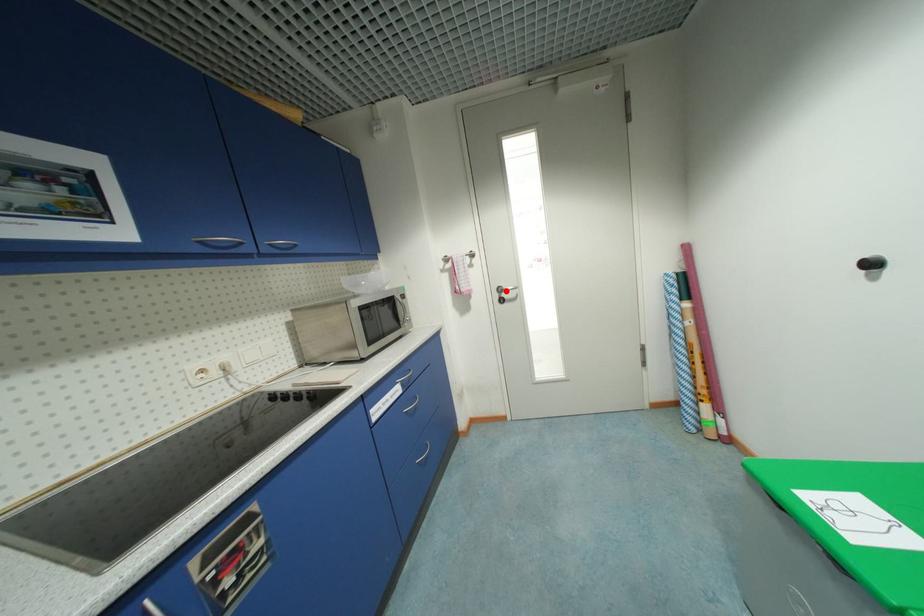
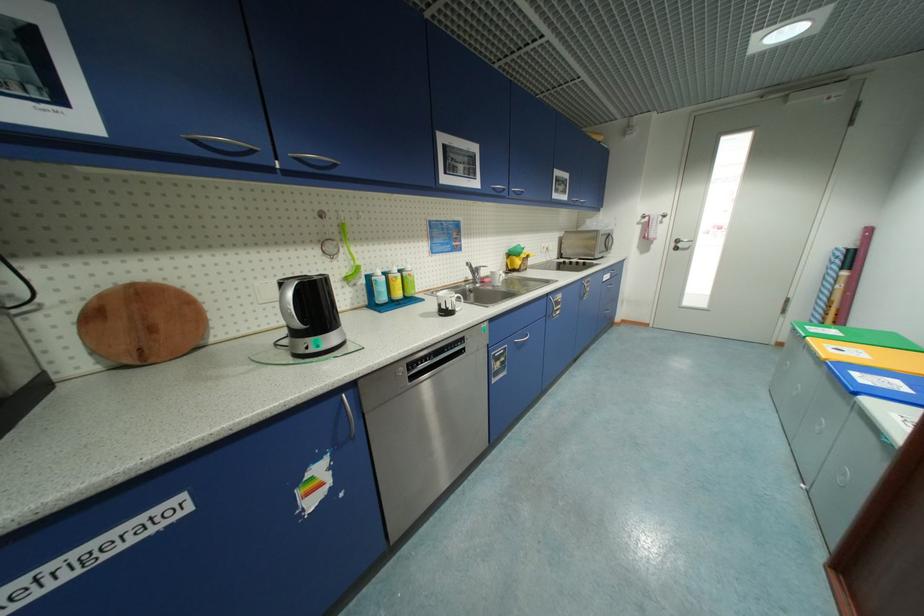
Find the pixel in the second image that matches the highlighted location in the first image.

(684, 241)